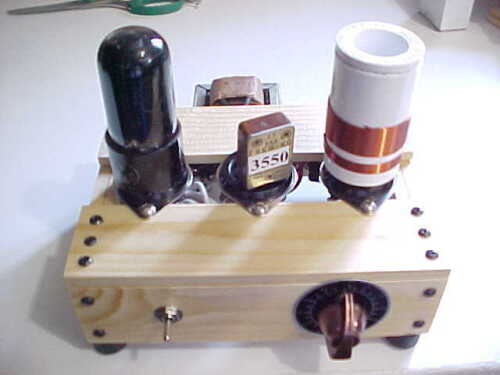
Locate an element on the screen. The image size is (500, 375). white surface is located at coordinates (460, 116).